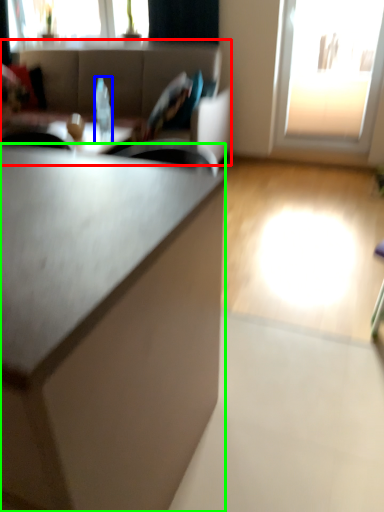
Question: Which is farther away from studio couch (highlighted by a red box)? bottle (highlighted by a blue box) or cabinetry (highlighted by a green box)?

Choices:
 (A) bottle
 (B) cabinetry

Answer: (B)